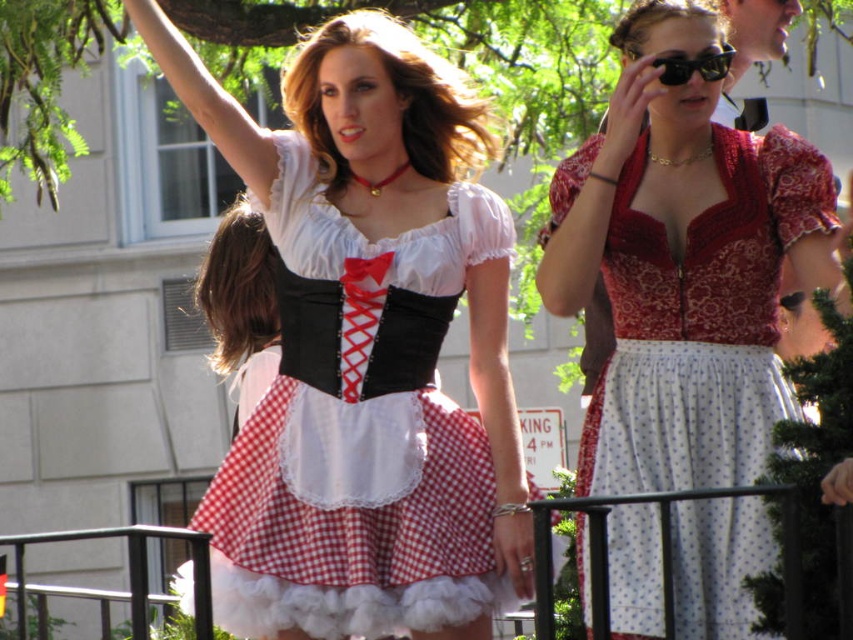
You are at a cultural event and want to take a photo with the red lace dress at center. There is a black metal rail at lower center in the way. Can you move around the rail to get a clear shot of the dress?

The black metal rail at lower center is behind the red lace dress at center, so moving around the rail should allow you to take a clear photo of the dress without obstruction.

You are standing in a room and want to reach the black metal rail at lower center. There is a red checkered dress at center in your way. Can you walk around it to get to the rail?

The red checkered dress at center is further to the viewer than the black metal rail at lower center, so the dress is closer to you. Therefore, you can walk around it to reach the rail.